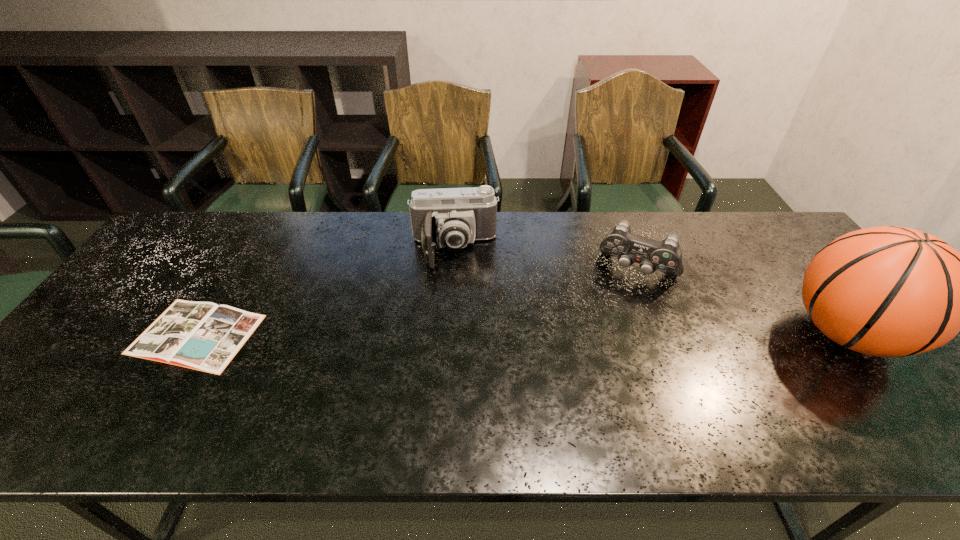
You are a GUI agent. You are given a task and a screenshot of the screen. Output one action in this format:
    pyautogui.click(x=<x>, y=<y>)
    Task: Click on the vacant region located 0.070m at the front of the camera with an open lens cover
    The image size is (960, 540).
    Given the screenshot: What is the action you would take?
    pyautogui.click(x=456, y=289)

In order to click on vacant space located at the front of the camera with an open lens cover in this screenshot , I will do `click(459, 364)`.

At what (x,y) coordinates should I click in order to perform the action: click on free space located 0.110m on the surface of the third object from left to right with buttons. Please return your answer as a coordinate pair (x, y). Image resolution: width=960 pixels, height=540 pixels. Looking at the image, I should click on (613, 313).

Locate an element on the screen. This screenshot has width=960, height=540. free point located 0.100m on the surface of the third object from left to right with buttons is located at coordinates (614, 310).

Locate an element on the screen. free space located 0.390m on the surface of the third object from left to right with buttons is located at coordinates (577, 393).

The height and width of the screenshot is (540, 960). Find the location of `camera that is at the far edge`. camera that is at the far edge is located at coordinates (x=452, y=217).

Find the location of a particular element. The height and width of the screenshot is (540, 960). control situated at the far edge is located at coordinates point(666,256).

Image resolution: width=960 pixels, height=540 pixels. Find the location of `book that is at the near edge`. book that is at the near edge is located at coordinates (204, 336).

Where is `basketball at the near edge`? basketball at the near edge is located at coordinates (887, 291).

At what (x,y) coordinates should I click in order to perform the action: click on object present at the left edge. Please return your answer as a coordinate pair (x, y). Looking at the image, I should click on (204, 336).